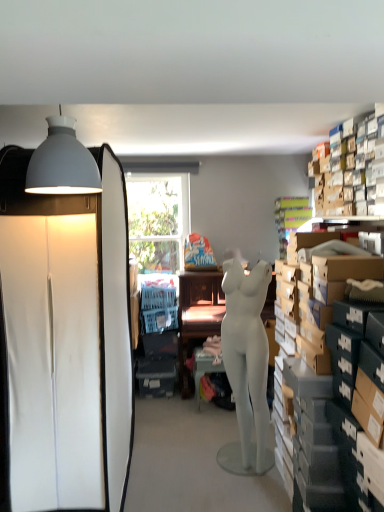
Question: Considering the positions of matte gray lampshade at upper left and white matte cabinet at left in the image, is matte gray lampshade at upper left wider or thinner than white matte cabinet at left?

Choices:
 (A) thin
 (B) wide

Answer: (A)

Question: From a real-world perspective, is matte gray lampshade at upper left physically located above or below white matte cabinet at left?

Choices:
 (A) above
 (B) below

Answer: (A)

Question: Estimate the real-world distances between objects in this image. Which object is farther from the matte brown desk at center?

Choices:
 (A) white matte mannequin at center
 (B) matte gray table at center
 (C) white matte cabinet at left
 (D) matte gray lampshade at upper left

Answer: (D)

Question: Estimate the real-world distances between objects in this image. Which object is closer to the white matte cabinet at left?

Choices:
 (A) matte gray lampshade at upper left
 (B) white matte mannequin at center
 (C) matte brown desk at center
 (D) matte gray table at center

Answer: (A)